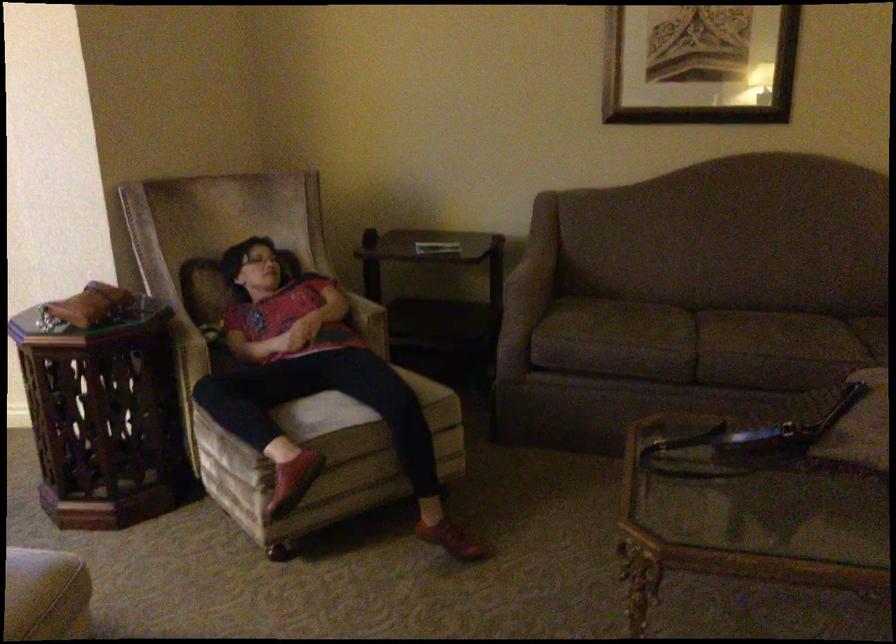
Describe the element at coordinates (695, 345) in the screenshot. I see `the sofa sitting surface` at that location.